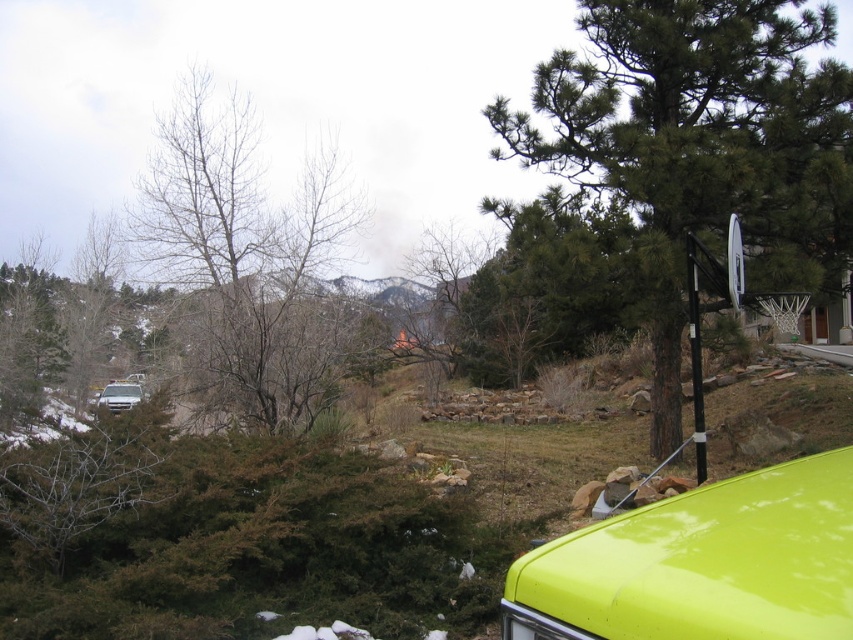
Question: Which object is positioned closest to the green leafy tree at center-right?

Choices:
 (A) lime green plastic truck at lower right
 (B) bare branches at left

Answer: (B)

Question: Is lime green plastic truck at lower right wider than bare branches at left?

Choices:
 (A) no
 (B) yes

Answer: (A)

Question: Which of the following is the farthest from the observer?

Choices:
 (A) (122, 404)
 (B) (660, 314)

Answer: (A)

Question: Does bare branches at left appear on the right side of matte silver suv at left?

Choices:
 (A) yes
 (B) no

Answer: (A)

Question: Considering the real-world distances, which object is closest to the lime green plastic truck at lower right?

Choices:
 (A) matte silver suv at left
 (B) bare branches at left

Answer: (A)

Question: Can you confirm if green leafy tree at center-right is positioned to the right of bare branches at left?

Choices:
 (A) no
 (B) yes

Answer: (B)